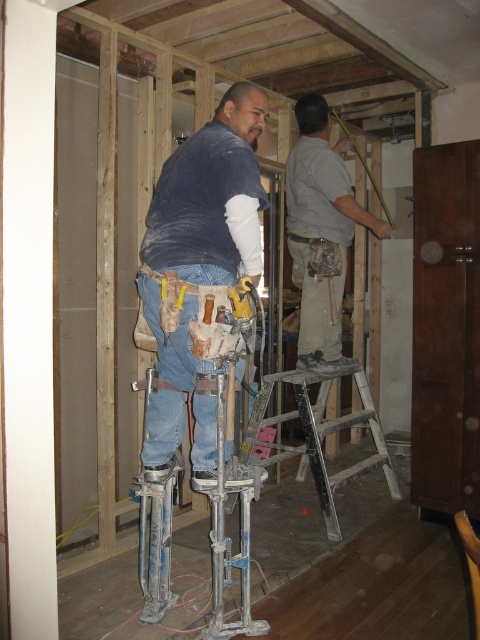
Is point (320, 340) positioned behind point (362, 394)?

No, it is in front of (362, 394).

Between gray fabric shirt at upper center and metallic silver ladder at center, which one appears on the right side from the viewer's perspective?

gray fabric shirt at upper center

Between point (308, 150) and point (359, 474), which one is positioned in front?

Point (308, 150) is more forward.

Locate an element on the screen. The width and height of the screenshot is (480, 640). gray fabric shirt at upper center is located at coordinates (321, 230).

Between blue denim jeans at center and metallic silver ladder at center, which one has less height?

metallic silver ladder at center

Who is positioned more to the left, blue denim jeans at center or metallic silver ladder at center?

From the viewer's perspective, blue denim jeans at center appears more on the left side.

Who is more forward, (186,145) or (262,465)?

Point (186,145) is more forward.

This screenshot has height=640, width=480. I want to click on blue denim jeans at center, so click(200, 244).

The width and height of the screenshot is (480, 640). What do you see at coordinates (200, 244) in the screenshot?
I see `blue denim jeans at center` at bounding box center [200, 244].

In the scene shown: Can you confirm if blue denim jeans at center is wider than gray fabric shirt at upper center?

In fact, blue denim jeans at center might be narrower than gray fabric shirt at upper center.

Find the location of a particular element. Image resolution: width=480 pixels, height=640 pixels. blue denim jeans at center is located at coordinates (200, 244).